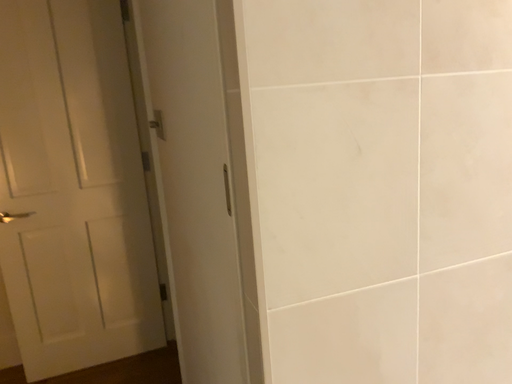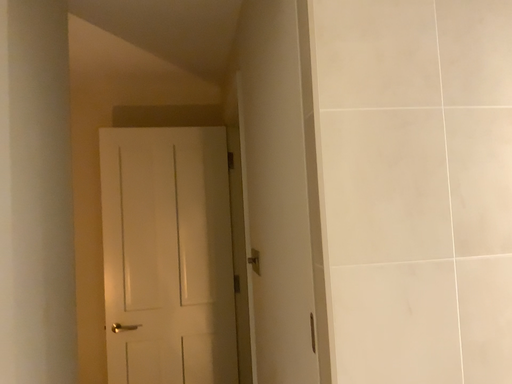
Question: How did the camera likely rotate when shooting the video?

Choices:
 (A) rotated downward
 (B) rotated upward

Answer: (B)